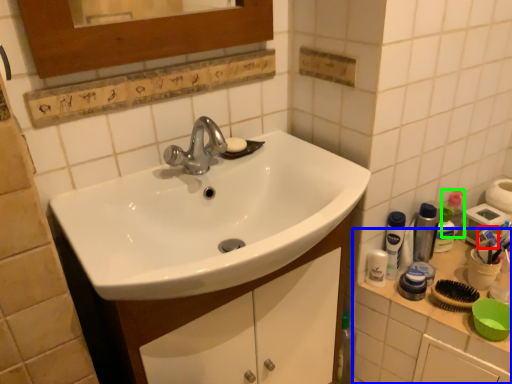
Question: Considering the real-world distances, which object is closest to toothpaste (highlighted by a red box)? counter top (highlighted by a blue box) or mouthwash (highlighted by a green box).

Choices:
 (A) counter top
 (B) mouthwash

Answer: (B)